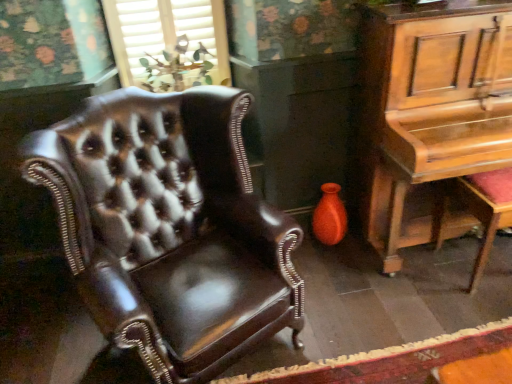
Locate an element on the screen. shiny brown leather armchair at left is located at coordinates (170, 228).

This screenshot has height=384, width=512. What do you see at coordinates (429, 111) in the screenshot? I see `wooden piano at right` at bounding box center [429, 111].

What do you see at coordinates (169, 43) in the screenshot?
I see `matte wood window at upper center` at bounding box center [169, 43].

What is the approximate width of red cushioned stool at right?

red cushioned stool at right is 15.08 inches in width.

Identify the location of shiny brown leather armchair at left. [x=170, y=228].

Visually, is matte wood window at upper center positioned to the left or to the right of matte orange vase at lower right?

Based on their positions, matte wood window at upper center is located to the left of matte orange vase at lower right.

Can you confirm if matte wood window at upper center is thinner than matte orange vase at lower right?

Indeed, matte wood window at upper center has a lesser width compared to matte orange vase at lower right.

The height and width of the screenshot is (384, 512). I want to click on window on the left of the matte orange vase at lower right, so click(x=169, y=43).

From the image's perspective, which one is positioned higher, matte wood window at upper center or matte orange vase at lower right?

matte wood window at upper center is shown above in the image.

From a real-world perspective, which is physically above, wooden piano at right or matte orange vase at lower right?

wooden piano at right is physically above.

Is wooden piano at right not inside matte orange vase at lower right?

Yes.

Which of these two, wooden piano at right or matte orange vase at lower right, is bigger?

Bigger between the two is wooden piano at right.

Is red cushioned stool at right positioned in front of matte orange vase at lower right?

Yes, red cushioned stool at right is closer to the viewer.

Consider the image. From a real-world perspective, is red cushioned stool at right positioned above or below matte orange vase at lower right?

From a real-world perspective, red cushioned stool at right is physically above matte orange vase at lower right.

Image resolution: width=512 pixels, height=384 pixels. Identify the location of music stool that appears above the matte orange vase at lower right (from a real-world perspective). (486, 210).

Is wooden piano at right positioned beyond the bounds of matte wood window at upper center?

Yes, wooden piano at right is outside of matte wood window at upper center.

Can you confirm if wooden piano at right is positioned to the right of matte wood window at upper center?

Yes, wooden piano at right is to the right of matte wood window at upper center.

Is wooden piano at right touching matte wood window at upper center?

No, wooden piano at right is not making contact with matte wood window at upper center.

Consider the image. In terms of width, does wooden piano at right look wider or thinner when compared to matte wood window at upper center?

wooden piano at right is wider than matte wood window at upper center.

Based on the photo, is matte orange vase at lower right positioned in front of red cushioned stool at right?

No, matte orange vase at lower right is further to the viewer.

Considering the relative sizes of matte orange vase at lower right and red cushioned stool at right in the image provided, is matte orange vase at lower right bigger than red cushioned stool at right?

No.

From the picture: Do you think matte orange vase at lower right is within red cushioned stool at right, or outside of it?

matte orange vase at lower right is located beyond the bounds of red cushioned stool at right.

From a real-world perspective, relative to red cushioned stool at right, is matte orange vase at lower right vertically above or below?

Clearly, from a real-world perspective, matte orange vase at lower right is below red cushioned stool at right.

From the picture: Is matte orange vase at lower right with wooden piano at right?

No, matte orange vase at lower right is not touching wooden piano at right.

There is a matte orange vase at lower right. Identify the location of table above it (from a real-world perspective). This screenshot has height=384, width=512. (429, 111).

From the image's perspective, relative to wooden piano at right, is matte orange vase at lower right above or below?

From the image's perspective, matte orange vase at lower right appears below wooden piano at right.

Considering the relative positions of matte orange vase at lower right and wooden piano at right in the image provided, is matte orange vase at lower right behind wooden piano at right?

Yes, matte orange vase at lower right is behind wooden piano at right.

Is shiny brown leather armchair at left oriented towards matte wood window at upper center?

No.

Looking at this image, is shiny brown leather armchair at left further to camera compared to matte wood window at upper center?

No, shiny brown leather armchair at left is closer to the camera.

Considering the sizes of objects shiny brown leather armchair at left and matte wood window at upper center in the image provided, who is wider, shiny brown leather armchair at left or matte wood window at upper center?

Wider between the two is shiny brown leather armchair at left.

Who is shorter, shiny brown leather armchair at left or matte wood window at upper center?

Standing shorter between the two is matte wood window at upper center.

Locate an element on the screen. This screenshot has width=512, height=384. vase that appears below the matte wood window at upper center (from the image's perspective) is located at coordinates (330, 216).

In the image, there is a matte orange vase at lower right. Where is `table above it (from the image's perspective)`? table above it (from the image's perspective) is located at coordinates (429, 111).

Estimate the real-world distances between objects in this image. Which object is closer to wooden piano at right, red cushioned stool at right or matte wood window at upper center?

Among the two, red cushioned stool at right is located nearer to wooden piano at right.

When comparing their distances from wooden piano at right, does matte orange vase at lower right or red cushioned stool at right seem closer?

Among the two, red cushioned stool at right is located nearer to wooden piano at right.

Estimate the real-world distances between objects in this image. Which object is further from matte orange vase at lower right, matte wood window at upper center or shiny brown leather armchair at left?

matte wood window at upper center.

Based on the photo, estimate the real-world distances between objects in this image. Which object is further from red cushioned stool at right, shiny brown leather armchair at left or matte orange vase at lower right?

shiny brown leather armchair at left is further to red cushioned stool at right.

Estimate the real-world distances between objects in this image. Which object is closer to matte orange vase at lower right, matte wood window at upper center or red cushioned stool at right?

red cushioned stool at right is closer to matte orange vase at lower right.

Based on their spatial positions, is red cushioned stool at right or wooden piano at right closer to shiny brown leather armchair at left?

The object closer to shiny brown leather armchair at left is wooden piano at right.

Looking at the image, which one is located closer to matte wood window at upper center, red cushioned stool at right or matte orange vase at lower right?

Among the two, matte orange vase at lower right is located nearer to matte wood window at upper center.

Based on their spatial positions, is wooden piano at right or shiny brown leather armchair at left further from matte orange vase at lower right?

shiny brown leather armchair at left.

At what (x,y) coordinates should I click in order to perform the action: click on vase between shiny brown leather armchair at left and red cushioned stool at right. Please return your answer as a coordinate pair (x, y). This screenshot has width=512, height=384. Looking at the image, I should click on (330, 216).

Locate an element on the screen. chair between matte wood window at upper center and red cushioned stool at right in the horizontal direction is located at coordinates (170, 228).

You are a GUI agent. You are given a task and a screenshot of the screen. Output one action in this format:
    pyautogui.click(x=<x>, y=<y>)
    Task: Click on the chair between matte wood window at upper center and wooden piano at right from left to right
    This screenshot has height=384, width=512.
    Given the screenshot: What is the action you would take?
    pyautogui.click(x=170, y=228)

This screenshot has width=512, height=384. I want to click on vase between shiny brown leather armchair at left and wooden piano at right, so click(330, 216).